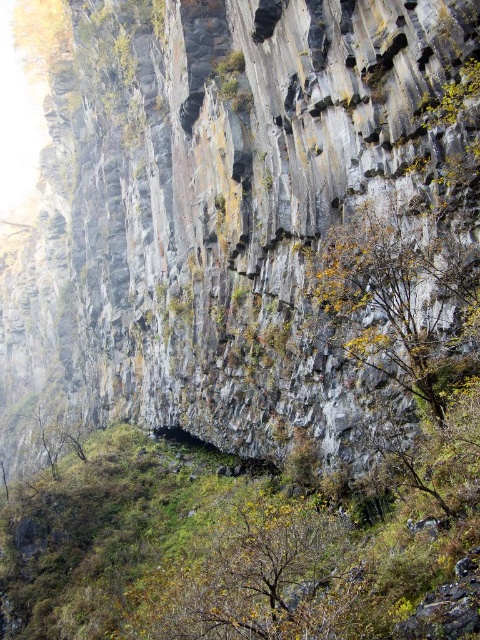
Is yellow-green leaves at center-right shorter than green leafy tree at lower left?

No.

Which is behind, point (355, 236) or point (74, 449)?

Point (74, 449)

Find the location of a particular element. yellow-green leaves at center-right is located at coordinates (398, 300).